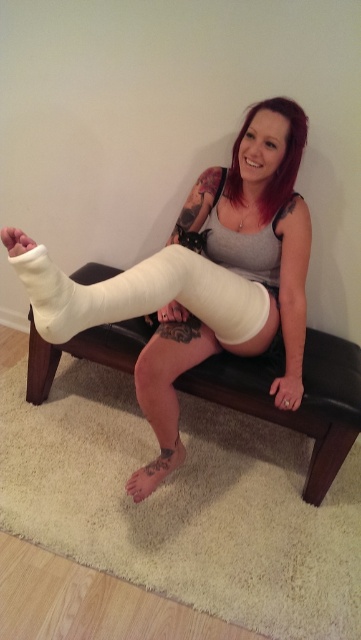
You are a physical therapist observing the person in the image. You need to assess whether the white cast at center is positioned over the smooth skin tattoo at lower center. Based on the scene, can you confirm this?

The white cast at center is in front of the smooth skin tattoo at lower center, so yes, the cast is positioned over the tattoo.

You are a physical therapist assessing the patient in the image. The white cast at center is on their injured leg, and the matte skin arm at lower center belongs to the same person. You need to check if the distance between these two body parts is sufficient to safely perform a stretching exercise that requires them to be at least 6 inches apart. Is the current distance acceptable?

The distance between the white cast at center and the matte skin arm at lower center is 7.61 inches, which exceeds the required 6 inches. Therefore, the current distance is sufficient to safely perform the stretching exercise.

You are a physical therapist assessing the patient in the image. The patient has a white cast at center and a white matte bandage at center. Which one is positioned higher on their leg?

The white cast at center is located above the white matte bandage at center, so it is positioned higher on the leg.